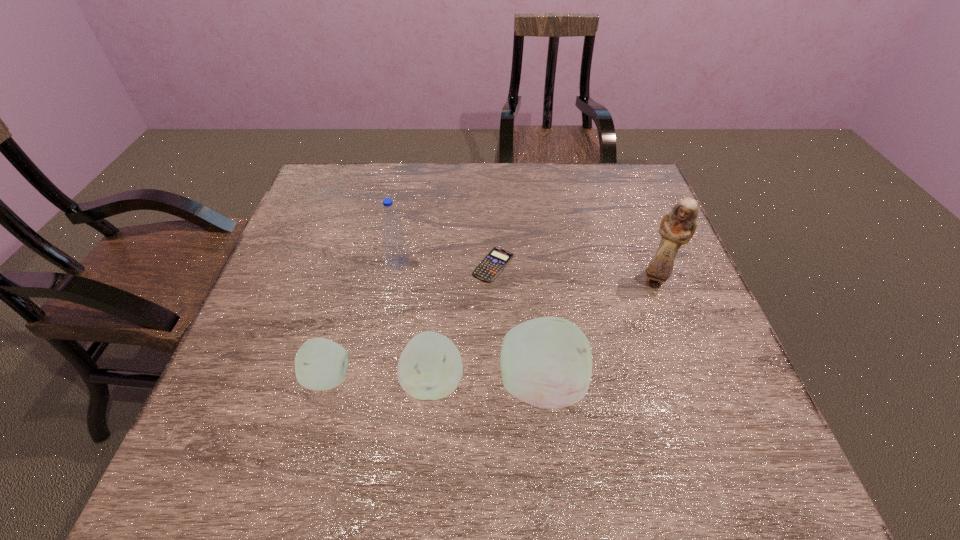
The height and width of the screenshot is (540, 960). In the image, there is a desktop. In order to click on blank space at the near left corner in this screenshot , I will do `click(255, 417)`.

Locate an element on the screen. This screenshot has height=540, width=960. free space at the far right corner of the desktop is located at coordinates (649, 201).

In the image, there is a desktop. Where is `blank space at the near right corner`? This screenshot has width=960, height=540. blank space at the near right corner is located at coordinates (684, 420).

Identify the location of empty space between the water bottle and the rightmost apple. (468, 323).

The image size is (960, 540). Find the location of `free space between the shortest object and the tallest object`. free space between the shortest object and the tallest object is located at coordinates (574, 273).

Find the location of a particular element. Image resolution: width=960 pixels, height=540 pixels. free space between the tallest apple and the third object from left to right is located at coordinates (486, 383).

Locate an element on the screen. Image resolution: width=960 pixels, height=540 pixels. empty space between the rightmost apple and the rightmost object is located at coordinates (x=597, y=333).

Locate an element on the screen. This screenshot has height=540, width=960. free spot between the third shortest object and the water bottle is located at coordinates (416, 322).

Find the location of a particular element. The height and width of the screenshot is (540, 960). vacant area between the second shortest object and the tallest object is located at coordinates (492, 329).

The height and width of the screenshot is (540, 960). What are the coordinates of `free space between the second apple from left to right and the calculator` in the screenshot? It's located at (464, 323).